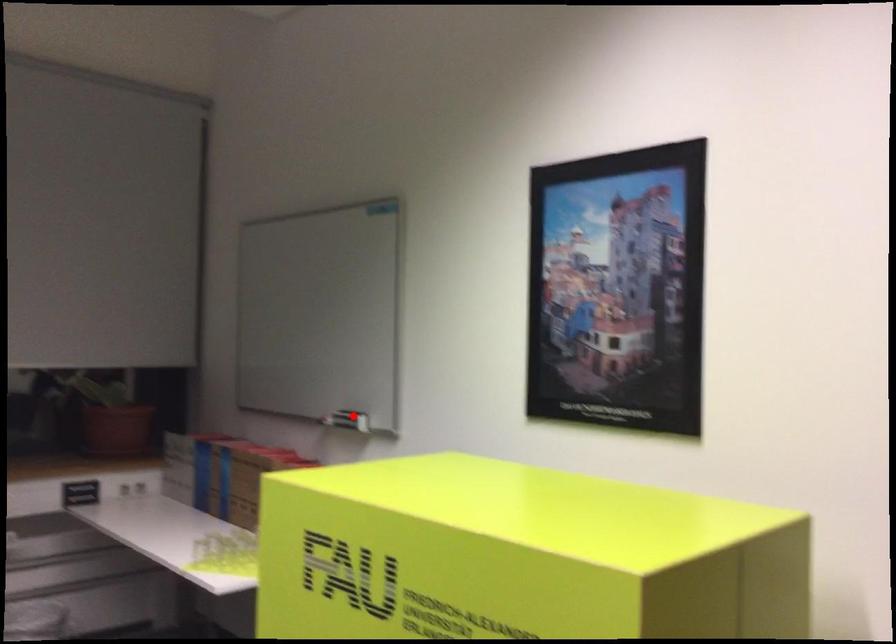
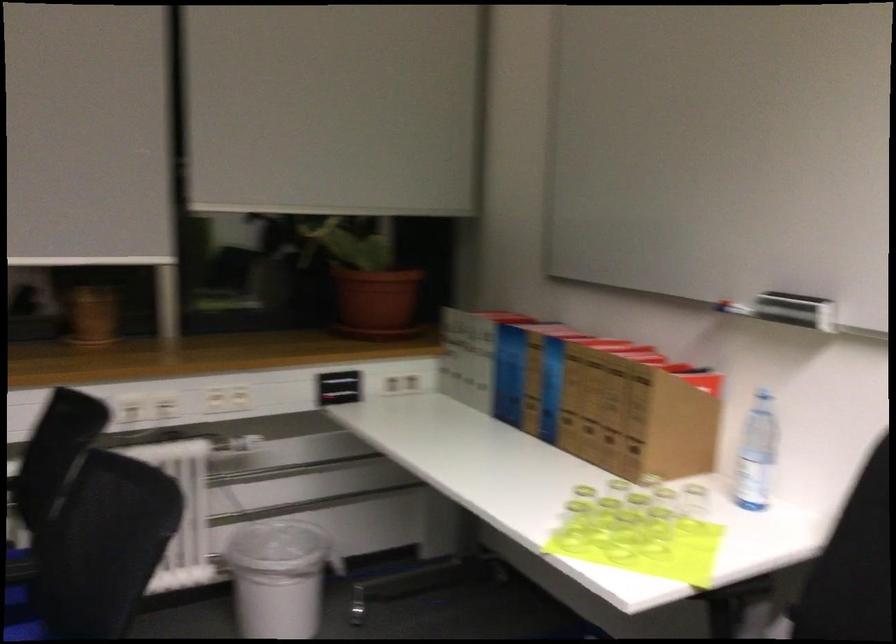
In the second image, find the point that corresponds to the highlighted location in the first image.

(795, 310)